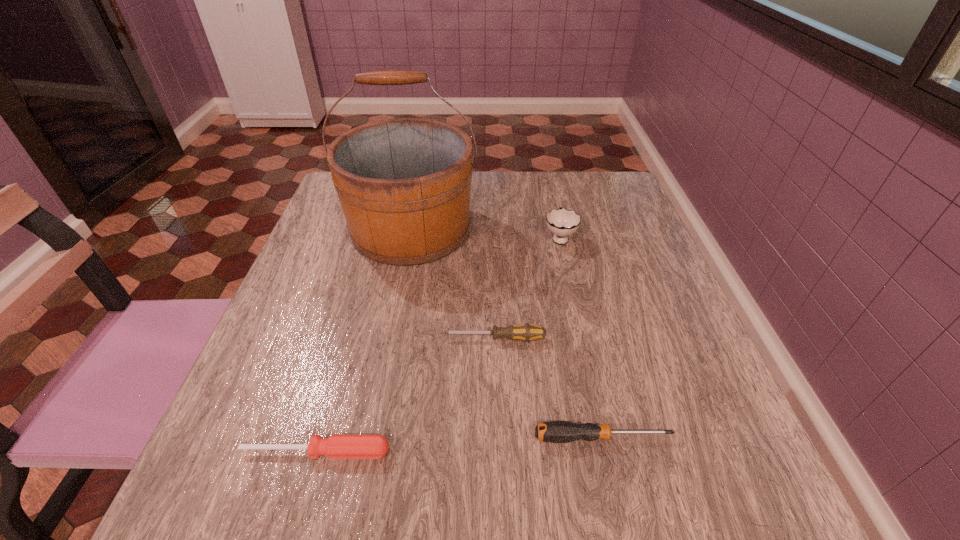
Identify the location of screwdriver that is the closest to the second tallest object. The height and width of the screenshot is (540, 960). (526, 332).

Locate an element on the screen. free point that satisfies the following two spatial constraints: 1. at the tip of the third nearest object; 2. on the front side of the leftmost screwdriver is located at coordinates (498, 452).